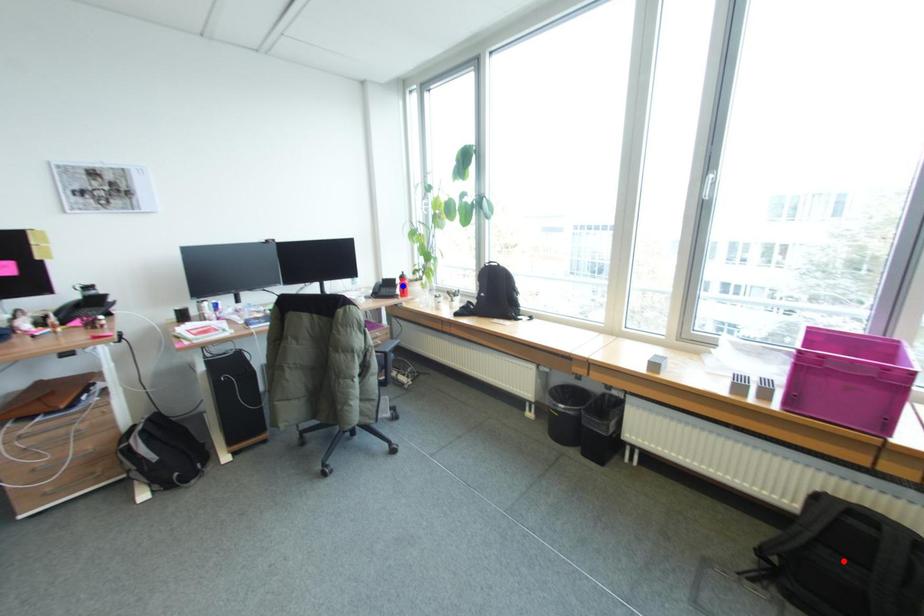
Question: Which of the two points in the image is closer to the camera?

Choices:
 (A) Blue point is closer.
 (B) Red point is closer.

Answer: (B)